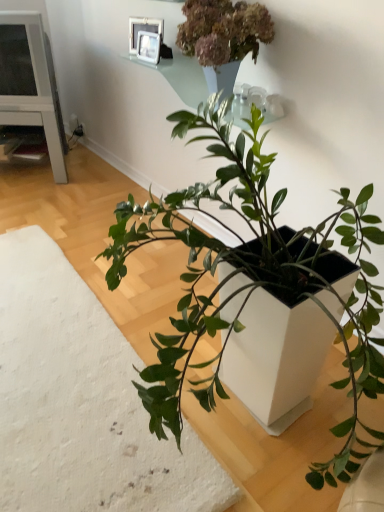
Question: In which direction should I rotate to look at white matte planter at center, which ranks as the 2th houseplant in right-to-left order?

Choices:
 (A) right
 (B) left

Answer: (B)

Question: Is white matte planter at center, marked as the 1th houseplant in a left-to-right arrangement, shorter than white glossy picture frame at upper center, which is the first picture frame in top-to-bottom order?

Choices:
 (A) no
 (B) yes

Answer: (B)

Question: Is white matte planter at center, which ranks as the 2th houseplant in right-to-left order, at the right side of white glossy picture frame at upper center, arranged as the second picture frame when ordered from the bottom?

Choices:
 (A) yes
 (B) no

Answer: (B)

Question: Is the depth of white matte planter at center, marked as the 1th houseplant in a left-to-right arrangement, less than that of white glossy picture frame at upper center, which is the first picture frame in top-to-bottom order?

Choices:
 (A) no
 (B) yes

Answer: (B)

Question: Would you consider white matte planter at center, marked as the 1th houseplant in a left-to-right arrangement, to be distant from white glossy picture frame at upper center, which is the first picture frame in top-to-bottom order?

Choices:
 (A) yes
 (B) no

Answer: (A)

Question: Is white matte planter at center, which ranks as the 2th houseplant in right-to-left order, positioned with its back to white glossy picture frame at upper center, arranged as the second picture frame when ordered from the bottom?

Choices:
 (A) no
 (B) yes

Answer: (A)

Question: Is white matte planter at center, marked as the 1th houseplant in a left-to-right arrangement, positioned beyond the bounds of white glossy picture frame at upper center, which is the first picture frame in top-to-bottom order?

Choices:
 (A) yes
 (B) no

Answer: (A)

Question: Is white glossy table at left located outside glassy white vase at upper center?

Choices:
 (A) no
 (B) yes

Answer: (B)

Question: Is white glossy table at left oriented away from glassy white vase at upper center?

Choices:
 (A) yes
 (B) no

Answer: (B)

Question: Is white glossy table at left wider than glassy white vase at upper center?

Choices:
 (A) yes
 (B) no

Answer: (A)

Question: Is white glossy table at left bigger than glassy white vase at upper center?

Choices:
 (A) no
 (B) yes

Answer: (B)

Question: Can glassy white vase at upper center be found inside white glossy table at left?

Choices:
 (A) yes
 (B) no

Answer: (B)

Question: Considering the relative sizes of white glossy table at left and glassy white vase at upper center in the image provided, is white glossy table at left smaller than glassy white vase at upper center?

Choices:
 (A) yes
 (B) no

Answer: (B)

Question: Considering the relative positions of white matte planter at lower left and metallic silver picture frame at upper center, marked as the 2th picture frame in a top-to-bottom arrangement, in the image provided, is white matte planter at lower left behind metallic silver picture frame at upper center, marked as the 2th picture frame in a top-to-bottom arrangement,?

Choices:
 (A) no
 (B) yes

Answer: (A)